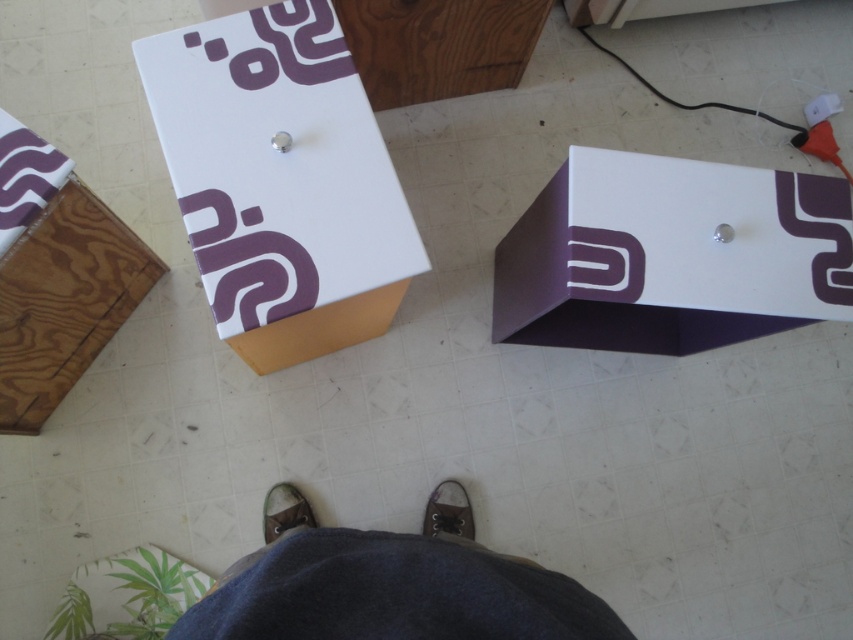
Based on the photo, you are standing in a room with two shoes at the center. You see a brown leather shoe at center and a brown suede shoe at center. Which shoe is positioned lower in the image?

The brown leather shoe at center is positioned lower because it is below the brown suede shoe at center.

You are trying to decide which shoe to wear for a formal event. Both the brown leather shoe at center and the brown suede shoe at center are options. Which one has a higher heel?

The brown leather shoe at center is much taller than the brown suede shoe at center, so the brown leather shoe at center has a higher heel.